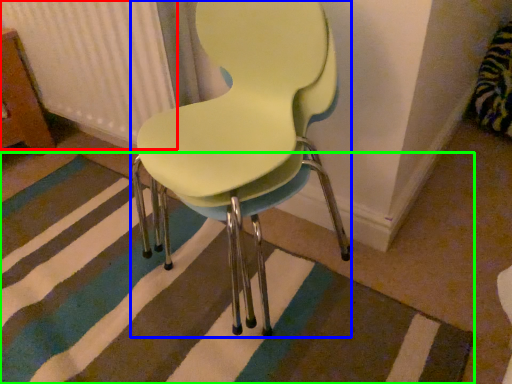
Question: Which object is positioned closest to radiator (highlighted by a red box)? Select from chair (highlighted by a blue box) and doormat (highlighted by a green box).

Choices:
 (A) chair
 (B) doormat

Answer: (A)